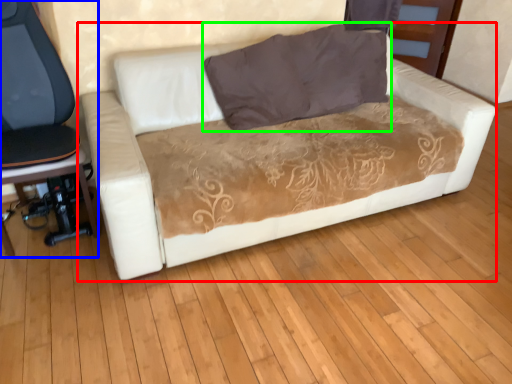
Question: Considering the real-world distances, which object is farthest from studio couch (highlighted by a red box)? chair (highlighted by a blue box) or pillow (highlighted by a green box)?

Choices:
 (A) chair
 (B) pillow

Answer: (A)